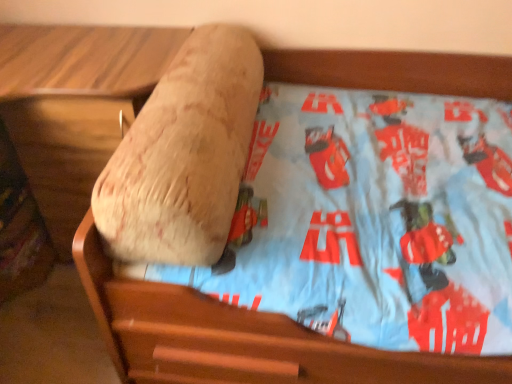
Find the location of a particular element. The height and width of the screenshot is (384, 512). wooden rolling pin at center is located at coordinates (184, 155).

Describe the element at coordinates (184, 155) in the screenshot. I see `wooden rolling pin at center` at that location.

Find the location of a particular element. This screenshot has width=512, height=384. wooden rolling pin at center is located at coordinates pyautogui.click(x=184, y=155).